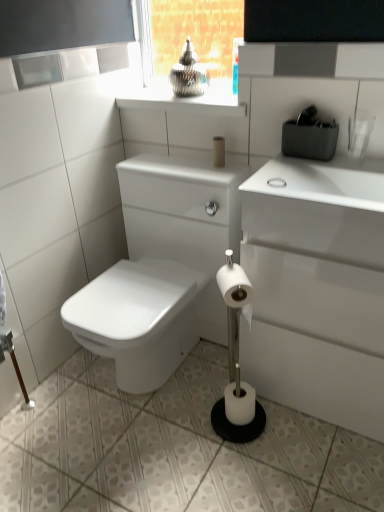
The width and height of the screenshot is (384, 512). I want to click on free spot to the left of white matte toilet paper at center, which is the second toilet paper in front-to-back order, so click(x=192, y=421).